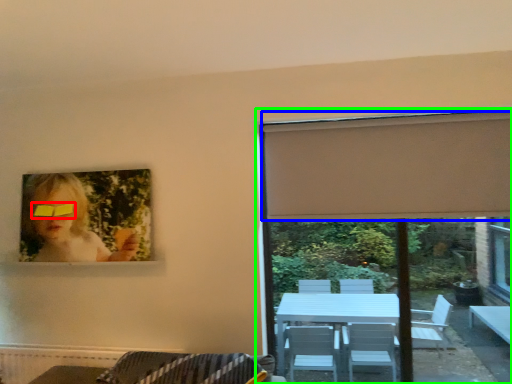
Question: Which is farther away from glasses (highlighted by a red box)? curtain (highlighted by a blue box) or window (highlighted by a green box)?

Choices:
 (A) curtain
 (B) window

Answer: (A)